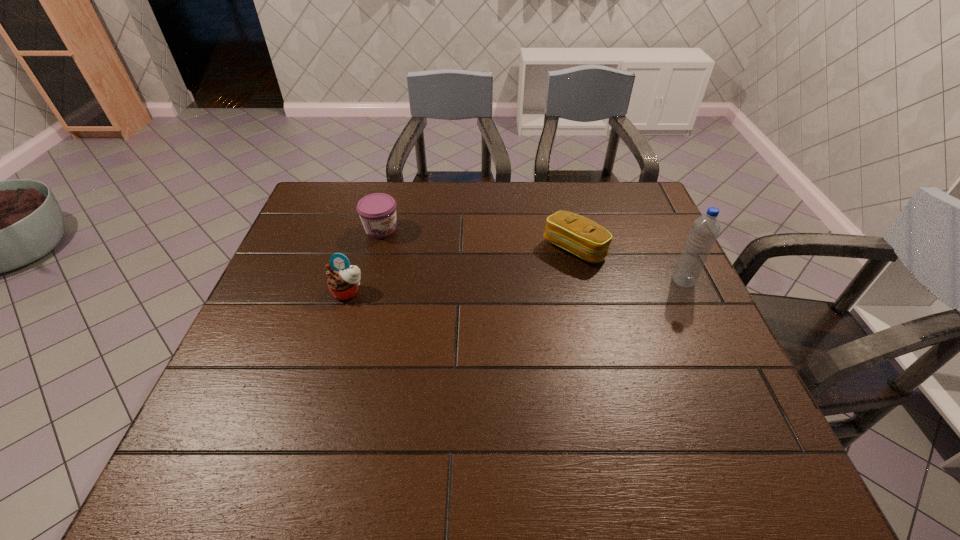
At what (x,y) coordinates should I click in order to perform the action: click on the closest object to the water bottle. Please return your answer as a coordinate pair (x, y). Looking at the image, I should click on (578, 235).

Find the location of a particular element. This screenshot has height=540, width=960. the closest object to the third shortest object is located at coordinates (377, 211).